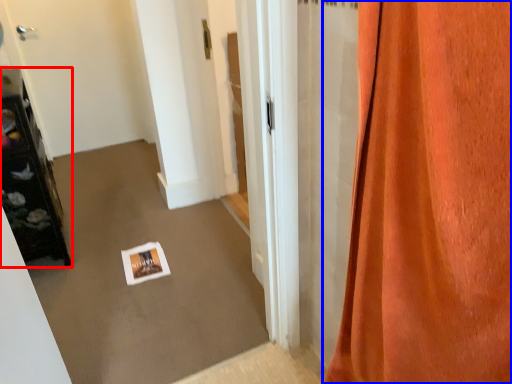
Question: Which point is closer to the camera, furniture (highlighted by a red box) or curtain (highlighted by a blue box)?

Choices:
 (A) furniture
 (B) curtain

Answer: (B)